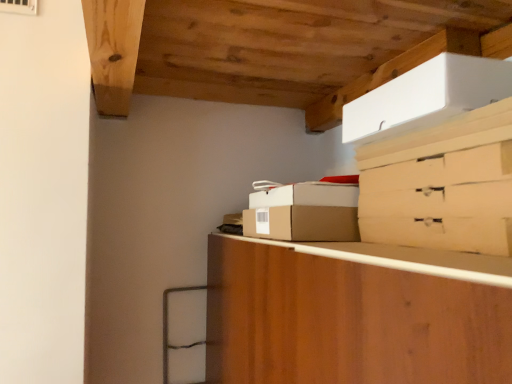
Describe the element at coordinates (347, 321) in the screenshot. Image resolution: width=512 pixels, height=384 pixels. I see `wooden cabinet at center` at that location.

In the scene shown: Measure the distance between brown cardboard box at center, which appears as the second cardboard box when viewed from the top, and camera.

brown cardboard box at center, which appears as the second cardboard box when viewed from the top, is 37.98 inches from camera.

The image size is (512, 384). In order to click on white cardboard box at upper right, the first cardboard box in the top-to-bottom sequence in this screenshot , I will do pyautogui.click(x=426, y=97).

Is wooden cabinet at center surrounding brown cardboard box at center, which appears as the second cardboard box when viewed from the top?

No, brown cardboard box at center, which appears as the second cardboard box when viewed from the top, is not a part of wooden cabinet at center.

Which is more to the left, wooden cabinet at center or brown cardboard box at center, which appears as the second cardboard box when viewed from the top?

brown cardboard box at center, which appears as the second cardboard box when viewed from the top, is more to the left.

Is wooden cabinet at center oriented towards brown cardboard box at center, placed as the 2th cardboard box when sorted from bottom to top?

No.

This screenshot has height=384, width=512. What are the coordinates of `cabinetry beneath the brown cardboard box at center, placed as the 2th cardboard box when sorted from bottom to top (from a real-world perspective)` in the screenshot? It's located at (347, 321).

Is brown cardboard box at center, which appears as the second cardboard box when viewed from the top, positioned in front of brown cardboard box at center, which is the first cardboard box in bottom-to-top order?

No, it is not.

From the picture: Can you tell me how much brown cardboard box at center, which appears as the second cardboard box when viewed from the top, and brown cardboard box at center, which is the 3th cardboard box in top-to-bottom order, differ in facing direction?

The facing directions of brown cardboard box at center, which appears as the second cardboard box when viewed from the top, and brown cardboard box at center, which is the 3th cardboard box in top-to-bottom order, are 0.000292 degrees apart.

Which of these two, brown cardboard box at center, which appears as the second cardboard box when viewed from the top, or brown cardboard box at center, which is the 3th cardboard box in top-to-bottom order, is bigger?

Bigger between the two is brown cardboard box at center, which is the 3th cardboard box in top-to-bottom order.

In the scene shown: Is brown cardboard box at center, which appears as the second cardboard box when viewed from the top, facing towards brown cardboard box at center, which is the first cardboard box in bottom-to-top order?

No, brown cardboard box at center, which appears as the second cardboard box when viewed from the top, does not turn towards brown cardboard box at center, which is the first cardboard box in bottom-to-top order.

Is wooden cabinet at center looking in the opposite direction of white cardboard box at upper right, the first cardboard box in the top-to-bottom sequence?

No, white cardboard box at upper right, the first cardboard box in the top-to-bottom sequence, is not at the back of wooden cabinet at center.

Is wooden cabinet at center taller or shorter than white cardboard box at upper right, which is the third cardboard box in bottom-to-top order?

Considering their sizes, wooden cabinet at center has more height than white cardboard box at upper right, which is the third cardboard box in bottom-to-top order.

Is wooden cabinet at center to the left of white cardboard box at upper right, the first cardboard box in the top-to-bottom sequence, from the viewer's perspective?

Yes, wooden cabinet at center is to the left of white cardboard box at upper right, the first cardboard box in the top-to-bottom sequence.

Is the depth of wooden cabinet at center less than that of white cardboard box at upper right, the first cardboard box in the top-to-bottom sequence?

Yes, it is.

Who is shorter, wooden cabinet at center or matte cardboard drawer at upper right?

matte cardboard drawer at upper right.

At what (x,y) coordinates should I click in order to perform the action: click on cabinetry located underneath the matte cardboard drawer at upper right (from a real-world perspective). Please return your answer as a coordinate pair (x, y). Looking at the image, I should click on (347, 321).

Consider the image. Who is more distant, matte cardboard drawer at upper right or brown cardboard box at center, which is the 3th cardboard box in top-to-bottom order?

brown cardboard box at center, which is the 3th cardboard box in top-to-bottom order, is further from the camera.

From the image's perspective, is matte cardboard drawer at upper right located above or below brown cardboard box at center, which is the first cardboard box in bottom-to-top order?

Based on their image positions, matte cardboard drawer at upper right is located above brown cardboard box at center, which is the first cardboard box in bottom-to-top order.

Is matte cardboard drawer at upper right outside of brown cardboard box at center, which is the 3th cardboard box in top-to-bottom order?

Yes, matte cardboard drawer at upper right is located beyond the bounds of brown cardboard box at center, which is the 3th cardboard box in top-to-bottom order.

Can you confirm if white cardboard box at upper right, the first cardboard box in the top-to-bottom sequence, is positioned to the left of wooden cabinet at center?

Incorrect, white cardboard box at upper right, the first cardboard box in the top-to-bottom sequence, is not on the left side of wooden cabinet at center.

Is wooden cabinet at center located within white cardboard box at upper right, which is the third cardboard box in bottom-to-top order?

Actually, wooden cabinet at center is outside white cardboard box at upper right, which is the third cardboard box in bottom-to-top order.

Where is `the 3rd cardboard box positioned above the wooden cabinet at center (from a real-world perspective)`? the 3rd cardboard box positioned above the wooden cabinet at center (from a real-world perspective) is located at coordinates (426, 97).

Based on their sizes in the image, would you say white cardboard box at upper right, the first cardboard box in the top-to-bottom sequence, is bigger or smaller than wooden cabinet at center?

In the image, white cardboard box at upper right, the first cardboard box in the top-to-bottom sequence, appears to be smaller than wooden cabinet at center.

Between brown cardboard box at center, which is the first cardboard box in bottom-to-top order, and white cardboard box at upper right, the first cardboard box in the top-to-bottom sequence, which one has smaller width?

Thinner between the two is brown cardboard box at center, which is the first cardboard box in bottom-to-top order.

From the image's perspective, does brown cardboard box at center, which is the first cardboard box in bottom-to-top order, appear lower than white cardboard box at upper right, the first cardboard box in the top-to-bottom sequence?

Indeed, from the image's perspective, brown cardboard box at center, which is the first cardboard box in bottom-to-top order, is shown beneath white cardboard box at upper right, the first cardboard box in the top-to-bottom sequence.

From a real-world perspective, between brown cardboard box at center, which is the first cardboard box in bottom-to-top order, and white cardboard box at upper right, which is the third cardboard box in bottom-to-top order, who is vertically lower?

From a 3D spatial view, brown cardboard box at center, which is the first cardboard box in bottom-to-top order, is below.

Is brown cardboard box at center, which is the 3th cardboard box in top-to-bottom order, not inside white cardboard box at upper right, which is the third cardboard box in bottom-to-top order?

That's correct, brown cardboard box at center, which is the 3th cardboard box in top-to-bottom order, is outside of white cardboard box at upper right, which is the third cardboard box in bottom-to-top order.

You are a GUI agent. You are given a task and a screenshot of the screen. Output one action in this format:
    pyautogui.click(x=<x>, y=<y>)
    Task: Click on the cabinetry in front of the brown cardboard box at center, which appears as the second cardboard box when viewed from the top
    The width and height of the screenshot is (512, 384).
    Given the screenshot: What is the action you would take?
    pyautogui.click(x=347, y=321)

In order to click on cardboard box below the brown cardboard box at center, placed as the 2th cardboard box when sorted from bottom to top (from a real-world perspective) in this screenshot , I will do `click(303, 223)`.

Which object lies nearer to the anchor point brown cardboard box at center, which appears as the second cardboard box when viewed from the top, matte cardboard drawer at upper right or brown cardboard box at center, which is the first cardboard box in bottom-to-top order?

brown cardboard box at center, which is the first cardboard box in bottom-to-top order, lies closer to brown cardboard box at center, which appears as the second cardboard box when viewed from the top, than the other object.

Considering their positions, is brown cardboard box at center, placed as the 2th cardboard box when sorted from bottom to top, positioned further to white cardboard box at upper right, which is the third cardboard box in bottom-to-top order, than wooden cabinet at center?

Among the two, wooden cabinet at center is located further to white cardboard box at upper right, which is the third cardboard box in bottom-to-top order.

From the image, which object appears to be nearer to brown cardboard box at center, placed as the 2th cardboard box when sorted from bottom to top, white cardboard box at upper right, which is the third cardboard box in bottom-to-top order, or brown cardboard box at center, which is the 3th cardboard box in top-to-bottom order?

brown cardboard box at center, which is the 3th cardboard box in top-to-bottom order, lies closer to brown cardboard box at center, placed as the 2th cardboard box when sorted from bottom to top, than the other object.

When comparing their distances from brown cardboard box at center, placed as the 2th cardboard box when sorted from bottom to top, does wooden cabinet at center or brown cardboard box at center, which is the first cardboard box in bottom-to-top order, seem closer?

Based on the image, brown cardboard box at center, which is the first cardboard box in bottom-to-top order, appears to be nearer to brown cardboard box at center, placed as the 2th cardboard box when sorted from bottom to top.

Based on their spatial positions, is brown cardboard box at center, which is the 3th cardboard box in top-to-bottom order, or wooden cabinet at center closer to brown cardboard box at center, which appears as the second cardboard box when viewed from the top?

The object closer to brown cardboard box at center, which appears as the second cardboard box when viewed from the top, is brown cardboard box at center, which is the 3th cardboard box in top-to-bottom order.

Based on their spatial positions, is matte cardboard drawer at upper right or white cardboard box at upper right, the first cardboard box in the top-to-bottom sequence, closer to wooden cabinet at center?

Based on the image, matte cardboard drawer at upper right appears to be nearer to wooden cabinet at center.

Estimate the real-world distances between objects in this image. Which object is closer to brown cardboard box at center, which is the first cardboard box in bottom-to-top order, white cardboard box at upper right, which is the third cardboard box in bottom-to-top order, or wooden cabinet at center?

wooden cabinet at center.

Based on the photo, estimate the real-world distances between objects in this image. Which object is further from matte cardboard drawer at upper right, white cardboard box at upper right, which is the third cardboard box in bottom-to-top order, or brown cardboard box at center, which appears as the second cardboard box when viewed from the top?

brown cardboard box at center, which appears as the second cardboard box when viewed from the top, is further to matte cardboard drawer at upper right.

Locate an element on the screen. cardboard box located between brown cardboard box at center, which is the first cardboard box in bottom-to-top order, and white cardboard box at upper right, which is the third cardboard box in bottom-to-top order, in the left-right direction is located at coordinates 304,194.

Identify the location of drawer between wooden cabinet at center and brown cardboard box at center, which is the first cardboard box in bottom-to-top order, along the z-axis. The width and height of the screenshot is (512, 384). (441, 233).

Where is `cardboard box located between brown cardboard box at center, placed as the 2th cardboard box when sorted from bottom to top, and matte cardboard drawer at upper right in the left-right direction`? The image size is (512, 384). cardboard box located between brown cardboard box at center, placed as the 2th cardboard box when sorted from bottom to top, and matte cardboard drawer at upper right in the left-right direction is located at coordinates (426, 97).

I want to click on drawer between wooden cabinet at center and brown cardboard box at center, placed as the 2th cardboard box when sorted from bottom to top, along the z-axis, so click(x=441, y=233).